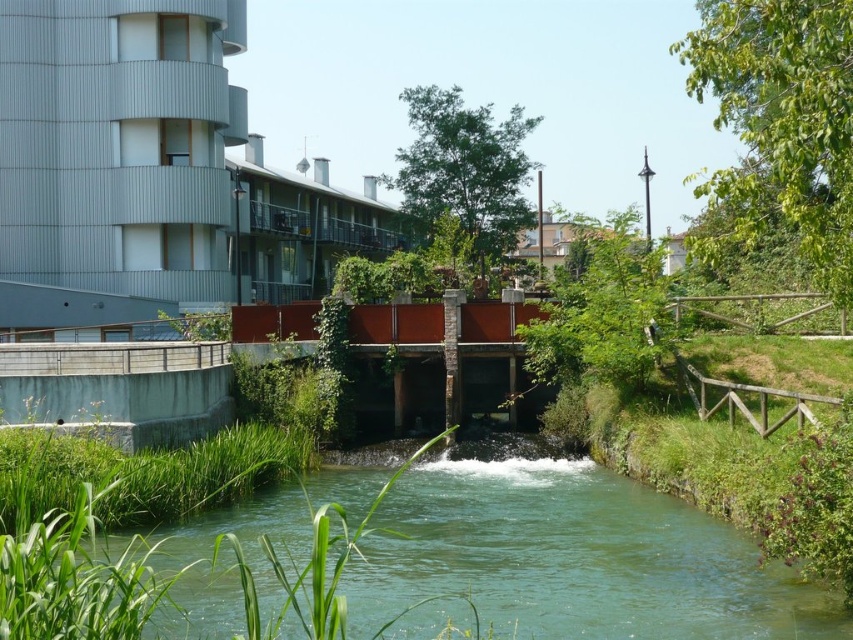
Between point (585, 595) and point (190, 262), which one is positioned in front?

Positioned in front is point (585, 595).

At what (x,y) coordinates should I click in order to perform the action: click on green translucent water at center. Please return your answer as a coordinate pair (x, y). Looking at the image, I should click on (573, 557).